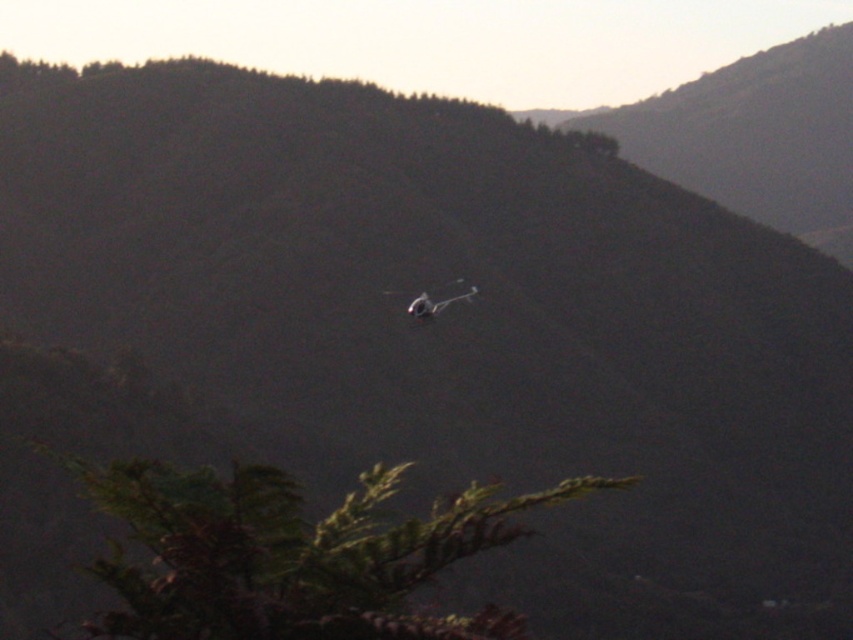
Question: Which point is closer to the camera taking this photo?

Choices:
 (A) (405, 308)
 (B) (331, 586)

Answer: (B)

Question: Which object is closer to the camera taking this photo?

Choices:
 (A) metallic gray plane at center
 (B) green leafy tree at lower center

Answer: (B)

Question: Can you confirm if green leafy tree at lower center is wider than metallic gray plane at center?

Choices:
 (A) yes
 (B) no

Answer: (B)

Question: Which point is closer to the camera?

Choices:
 (A) (430, 307)
 (B) (143, 536)

Answer: (B)

Question: Does green leafy tree at lower center appear on the right side of metallic gray plane at center?

Choices:
 (A) yes
 (B) no

Answer: (A)

Question: Can you confirm if green leafy tree at lower center is bigger than metallic gray plane at center?

Choices:
 (A) no
 (B) yes

Answer: (A)